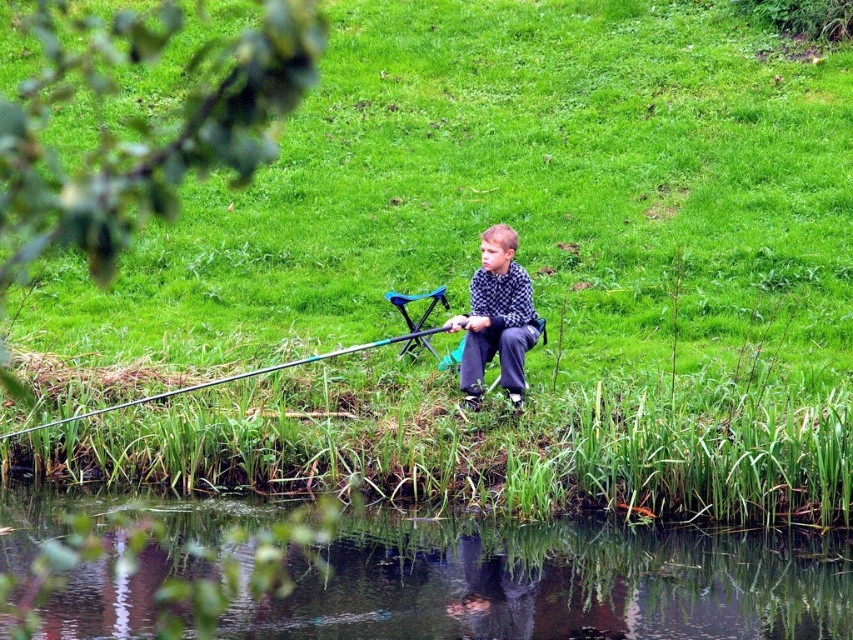
You are the boy in the scene and you want to see your fishing pole better. Which object should you look towards first, the transparent water at lower center or the teal glossy fishing pole at lower center?

The transparent water at lower center is in front of the teal glossy fishing pole at lower center, so you should look towards the transparent water at lower center first to see the fishing pole better.

You are observing a boy fishing in a serene outdoor setting. You notice the checkered fabric shirt at center and the teal glossy fishing pole at lower center. Which object appears larger in the image?

The teal glossy fishing pole at lower center appears larger than the checkered fabric shirt at center in the image.

You are standing at the point marked as point [558,584] in the image. What do you see directly beneath your feet?

The point [558,584] corresponds to transparent water at lower center, so you would see transparent water beneath your feet.